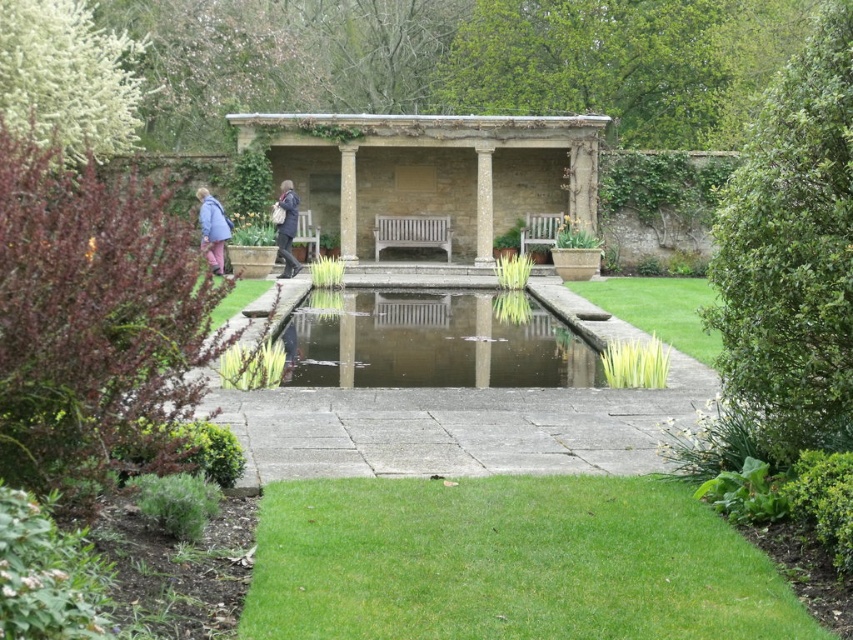
Does point (437, 212) come closer to viewer compared to point (218, 211)?

That is False.

This screenshot has width=853, height=640. I want to click on stone gazebo at center, so click(433, 166).

Can you confirm if stone gazebo at center is smaller than clear glass pond at center?

No, stone gazebo at center is not smaller than clear glass pond at center.

You are a GUI agent. You are given a task and a screenshot of the screen. Output one action in this format:
    pyautogui.click(x=<x>, y=<y>)
    Task: Click on the stone gazebo at center
    Image resolution: width=853 pixels, height=640 pixels.
    Given the screenshot: What is the action you would take?
    pyautogui.click(x=433, y=166)

Is clear glass pond at center thinner than dark blue coat at center?

No, clear glass pond at center is not thinner than dark blue coat at center.

From the picture: Which of these two, clear glass pond at center or dark blue coat at center, stands shorter?

clear glass pond at center

Where is `clear glass pond at center`? The image size is (853, 640). clear glass pond at center is located at coordinates (x=432, y=340).

Where is `clear glass pond at center`? clear glass pond at center is located at coordinates (432, 340).